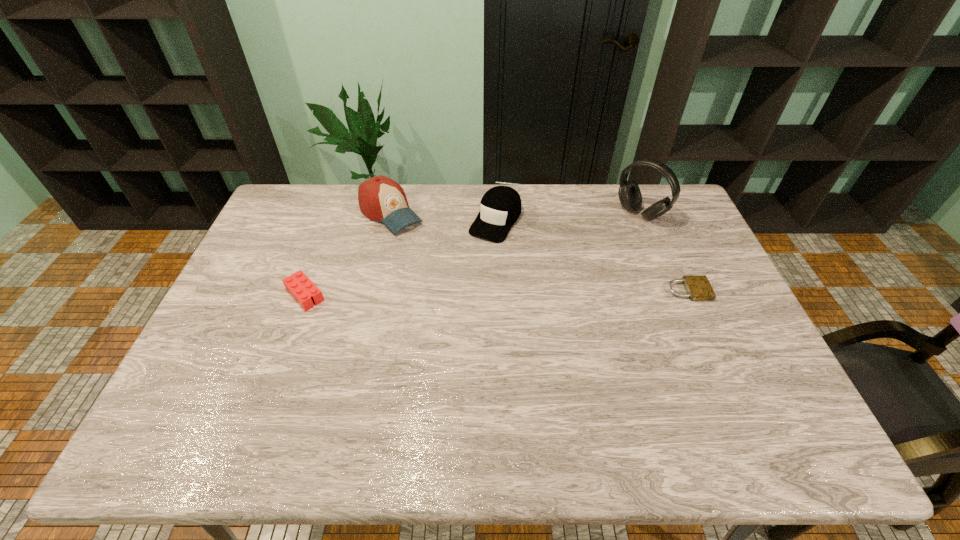
At what (x,y) coordinates should I click in order to perform the action: click on vacant region located 0.100m on the front-facing side of the second tallest object. Please return your answer as a coordinate pair (x, y). The width and height of the screenshot is (960, 540). Looking at the image, I should click on (425, 247).

You are a GUI agent. You are given a task and a screenshot of the screen. Output one action in this format:
    pyautogui.click(x=<x>, y=<y>)
    Task: Click on the free spot located 0.280m on the front-facing side of the second tallest object
    
    Given the screenshot: What is the action you would take?
    pyautogui.click(x=460, y=277)

The image size is (960, 540). In order to click on free space located 0.380m on the earcups of the tallest object in this screenshot , I will do `click(559, 281)`.

Find the location of a particular element. The image size is (960, 540). vacant space situated on the earcups of the tallest object is located at coordinates (612, 237).

I want to click on free point located on the earcups of the tallest object, so click(572, 269).

This screenshot has width=960, height=540. In order to click on free space located 0.390m on the front-facing side of the third tallest object in this screenshot , I will do `click(425, 327)`.

Find the location of a particular element. The height and width of the screenshot is (540, 960). vacant area situated 0.400m on the front-facing side of the third tallest object is located at coordinates (423, 329).

Where is `vacant space located 0.290m on the front-facing side of the third tallest object`? This screenshot has width=960, height=540. vacant space located 0.290m on the front-facing side of the third tallest object is located at coordinates (443, 302).

Where is `baseball cap that is positioned at the far edge`? The image size is (960, 540). baseball cap that is positioned at the far edge is located at coordinates (380, 198).

Locate an element on the screen. This screenshot has width=960, height=540. headset positioned at the far edge is located at coordinates (629, 193).